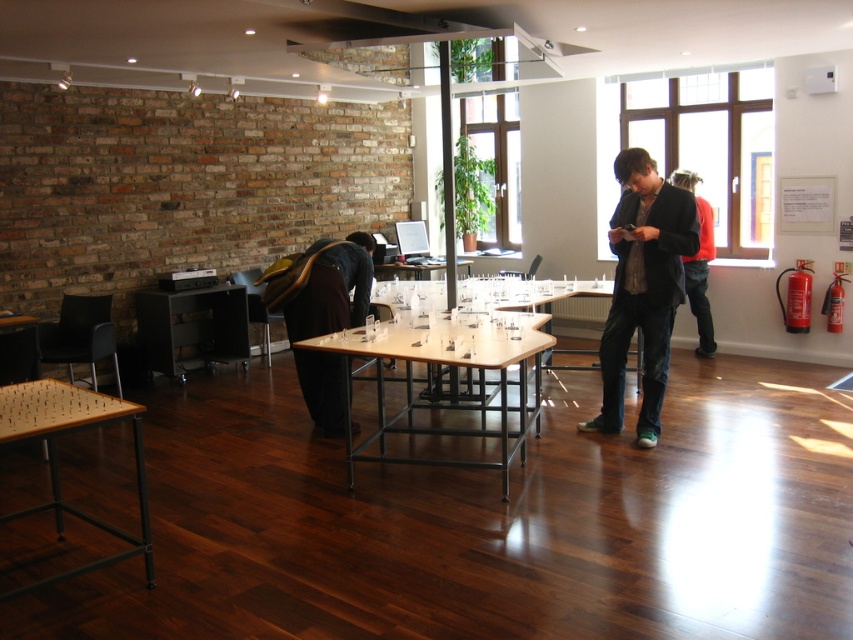
From the picture: You are a guest at an event and need to place a 15 cm tall vase on one of the tables. The brown fabric at center and the black matte table at center are both in your view. Which surface can accommodate the vase without it toppling over?

The brown fabric at center is much taller than the black matte table at center, so placing the vase on the black matte table at center would be safer to prevent it from toppling over.

You are organizing a small event in this room and need to place a decorative centerpiece on the brown fabric at center and the black matte table at center. Which object should you place it on if you want it closer to the brick wall on the left?

The brown fabric at center is positioned on the right side of the black matte table at center. Since the brick wall is on the left, placing the centerpiece on the brown fabric at center would place it closer to the wall because it is to the right of the table, which is further away from the wall.

From the picture: You are standing at the point labeled as point (624, 259) in the image. You want to place a 12 feet long banner between two tables such that it stretches from one end to the other without bending. Is there enough space between the tables to accommodate the banner?

The distance between the tables is 14.23 feet, which is greater than the 12 feet length of the banner. Therefore, there is enough space to place the banner between the tables without bending.